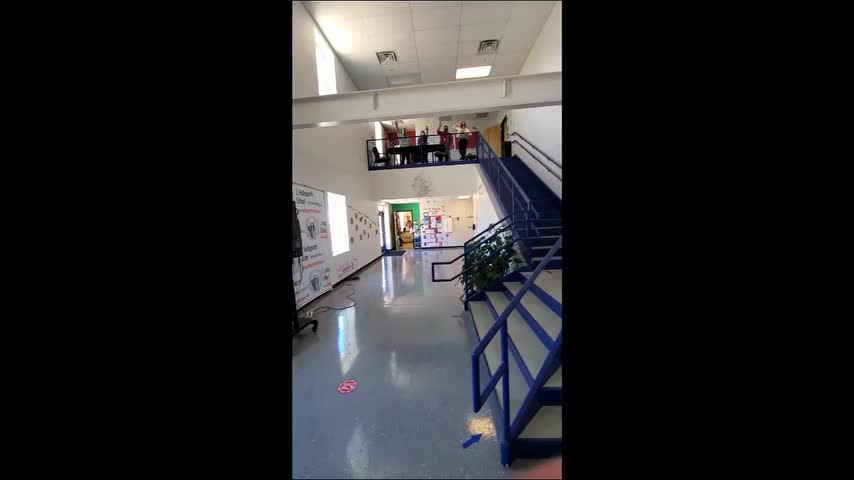
The width and height of the screenshot is (854, 480). Identify the location of ceiling light, left one turned off, right one on. (400, 82), (470, 74).